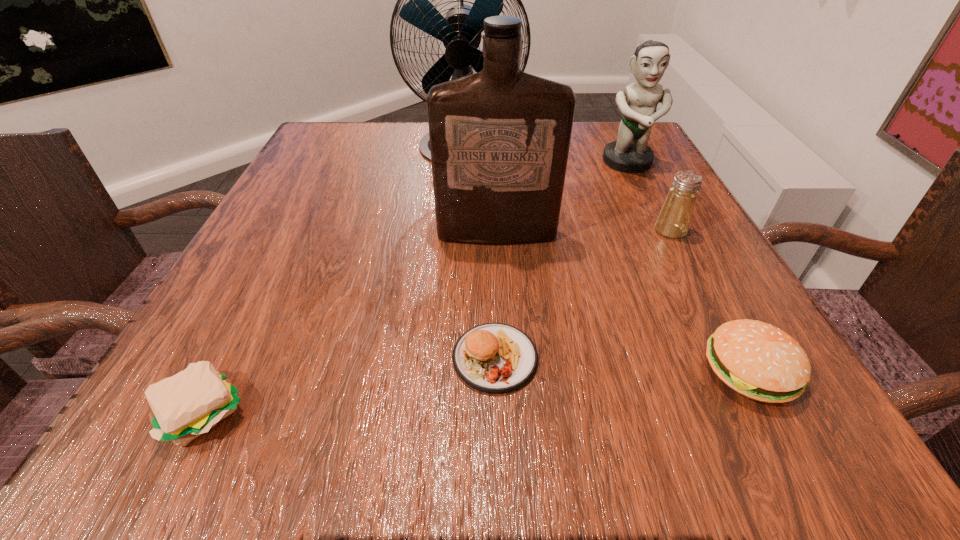
The height and width of the screenshot is (540, 960). In order to click on object that stands as the second closest to the second patty from right to left in this screenshot , I will do `click(760, 361)`.

Locate an element on the screen. Image resolution: width=960 pixels, height=540 pixels. the fifth closest object relative to the figurine is located at coordinates (495, 358).

Identify the location of patty that stands as the closest to the rightmost patty. The height and width of the screenshot is (540, 960). (495, 358).

Identify which patty is located as the second nearest to the leftmost object. Please provide its 2D coordinates. Your answer should be formatted as a tuple, i.e. [(x, y)], where the tuple contains the x and y coordinates of a point satisfying the conditions above.

[(760, 361)]

Where is `vacant space that satisfies the following two spatial constraints: 1. on the front-facing side of the second patty from right to left; 2. on the right side of the fan`? The height and width of the screenshot is (540, 960). vacant space that satisfies the following two spatial constraints: 1. on the front-facing side of the second patty from right to left; 2. on the right side of the fan is located at coordinates (453, 358).

Locate an element on the screen. free spot that satisfies the following two spatial constraints: 1. on the front-facing side of the second patty from right to left; 2. on the left side of the fan is located at coordinates (453, 358).

Identify the location of vacant space that satisfies the following two spatial constraints: 1. on the front-facing side of the saltshaker; 2. on the right side of the fan. The width and height of the screenshot is (960, 540). (460, 231).